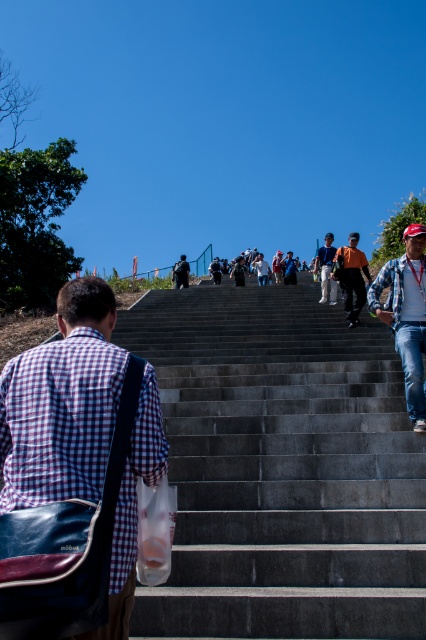
Is plaid fabric shirt at center to the left of orange fabric shirt at center from the viewer's perspective?

Indeed, plaid fabric shirt at center is positioned on the left side of orange fabric shirt at center.

Identify the location of plaid fabric shirt at center. (63, 403).

In order to click on plaid fabric shirt at center in this screenshot , I will do `click(63, 403)`.

Is the position of orange fabric shirt at center more distant than that of dark gray jeans at center?

No, it is not.

Is orange fabric shirt at center below dark gray jeans at center?

Yes.

Which is in front, point (348, 308) or point (321, 252)?

Point (348, 308)

I want to click on orange fabric shirt at center, so click(x=351, y=276).

Which is in front, point (362, 602) or point (180, 260)?

Point (362, 602) is in front.

Does smooth concrete stairs at center appear under dark gray backpack at center?

Indeed, smooth concrete stairs at center is positioned under dark gray backpack at center.

Is point (143, 600) positioned before point (180, 276)?

Yes, point (143, 600) is closer to viewer.

Locate an element on the screen. This screenshot has height=640, width=426. smooth concrete stairs at center is located at coordinates (282, 468).